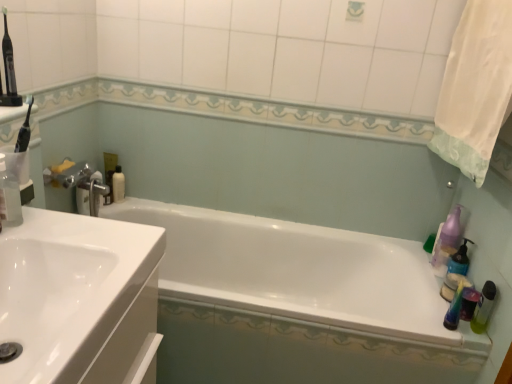
Question: Considering the relative sizes of purple translucent soap dispenser at right, positioned as the third cleaning product in left-to-right order, and translucent plastic pump bottle at right, which is the second cleaning product in right-to-left order, in the image provided, is purple translucent soap dispenser at right, positioned as the third cleaning product in left-to-right order, shorter than translucent plastic pump bottle at right, which is the second cleaning product in right-to-left order,?

Choices:
 (A) no
 (B) yes

Answer: (A)

Question: Is purple translucent soap dispenser at right, positioned as the third cleaning product in left-to-right order, thinner than translucent plastic pump bottle at right, which is counted as the second cleaning product, starting from the front?

Choices:
 (A) no
 (B) yes

Answer: (A)

Question: Considering the relative sizes of purple translucent soap dispenser at right, which is the 1th cleaning product in right-to-left order, and translucent plastic pump bottle at right, acting as the 2th cleaning product starting from the back, in the image provided, is purple translucent soap dispenser at right, which is the 1th cleaning product in right-to-left order, bigger than translucent plastic pump bottle at right, acting as the 2th cleaning product starting from the back,?

Choices:
 (A) yes
 (B) no

Answer: (A)

Question: Does purple translucent soap dispenser at right, which is the third cleaning product from front to back, have a greater height compared to translucent plastic pump bottle at right, which is counted as the second cleaning product, starting from the front?

Choices:
 (A) no
 (B) yes

Answer: (B)

Question: Is purple translucent soap dispenser at right, positioned as the third cleaning product in left-to-right order, positioned with its back to translucent plastic pump bottle at right, acting as the 2th cleaning product starting from the back?

Choices:
 (A) yes
 (B) no

Answer: (B)

Question: Is purple translucent soap dispenser at right, positioned as the third cleaning product in left-to-right order, outside translucent plastic pump bottle at right, arranged as the 2th cleaning product when viewed from the left?

Choices:
 (A) no
 (B) yes

Answer: (B)

Question: Considering the relative sizes of white fabric shower curtain at upper right and purple translucent soap dispenser at right, which ranks as the first cleaning product in back-to-front order, in the image provided, is white fabric shower curtain at upper right thinner than purple translucent soap dispenser at right, which ranks as the first cleaning product in back-to-front order,?

Choices:
 (A) no
 (B) yes

Answer: (A)

Question: Considering the relative positions of white fabric shower curtain at upper right and purple translucent soap dispenser at right, which is the third cleaning product from front to back, in the image provided, is white fabric shower curtain at upper right to the right of purple translucent soap dispenser at right, which is the third cleaning product from front to back, from the viewer's perspective?

Choices:
 (A) no
 (B) yes

Answer: (A)

Question: From a real-world perspective, is white fabric shower curtain at upper right positioned under purple translucent soap dispenser at right, positioned as the third cleaning product in left-to-right order, based on gravity?

Choices:
 (A) no
 (B) yes

Answer: (A)

Question: Can you confirm if white fabric shower curtain at upper right is positioned to the left of purple translucent soap dispenser at right, which is the 1th cleaning product in right-to-left order?

Choices:
 (A) yes
 (B) no

Answer: (A)

Question: Is purple translucent soap dispenser at right, which ranks as the first cleaning product in back-to-front order, surrounded by white fabric shower curtain at upper right?

Choices:
 (A) yes
 (B) no

Answer: (B)

Question: Is white fabric shower curtain at upper right positioned with its back to purple translucent soap dispenser at right, positioned as the third cleaning product in left-to-right order?

Choices:
 (A) no
 (B) yes

Answer: (A)

Question: Could you tell me if white glossy sink at left is facing translucent plastic mouthwash at right, marked as the first mouthwash in a right-to-left arrangement?

Choices:
 (A) yes
 (B) no

Answer: (A)